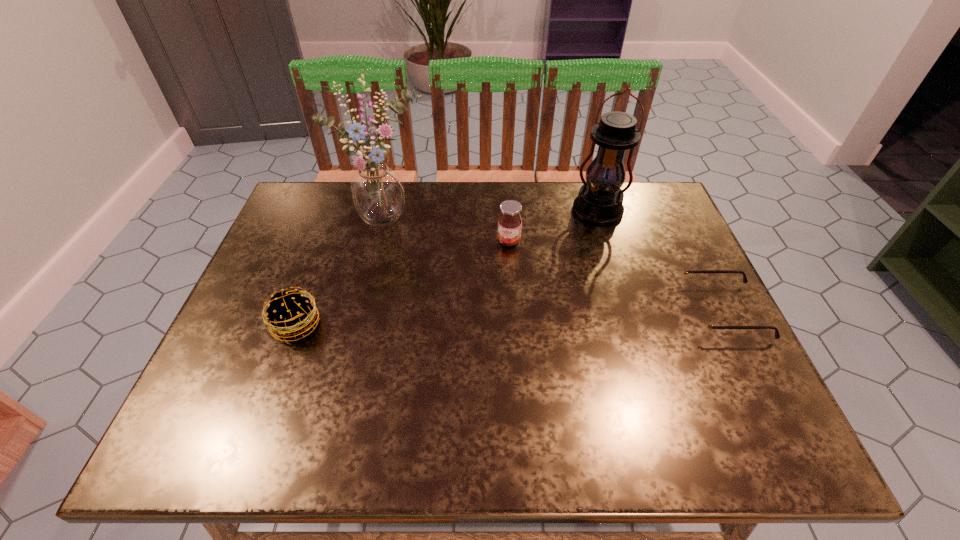
The width and height of the screenshot is (960, 540). In order to click on vacant space located on the front-facing side of the bouquet in this screenshot , I will do `click(421, 255)`.

Image resolution: width=960 pixels, height=540 pixels. I want to click on lantern at the far edge, so click(x=600, y=200).

Where is `bouquet present at the far edge`? This screenshot has width=960, height=540. bouquet present at the far edge is located at coordinates (377, 191).

Locate an element on the screen. The height and width of the screenshot is (540, 960). patty that is at the left edge is located at coordinates pyautogui.click(x=290, y=313).

Where is `bouquet located at the left edge`? The image size is (960, 540). bouquet located at the left edge is located at coordinates (377, 191).

In order to click on spectacles that is at the right edge in this screenshot , I will do tap(701, 321).

I want to click on lantern located at the right edge, so click(x=600, y=200).

The height and width of the screenshot is (540, 960). Find the location of `object at the far left corner`. object at the far left corner is located at coordinates (377, 191).

You are a GUI agent. You are given a task and a screenshot of the screen. Output one action in this format:
    pyautogui.click(x=<x>, y=<y>)
    Task: Click on the object that is at the far right corner
    Image resolution: width=960 pixels, height=540 pixels.
    Given the screenshot: What is the action you would take?
    pyautogui.click(x=600, y=200)

This screenshot has width=960, height=540. I want to click on vacant space at the far edge of the desktop, so click(x=576, y=195).